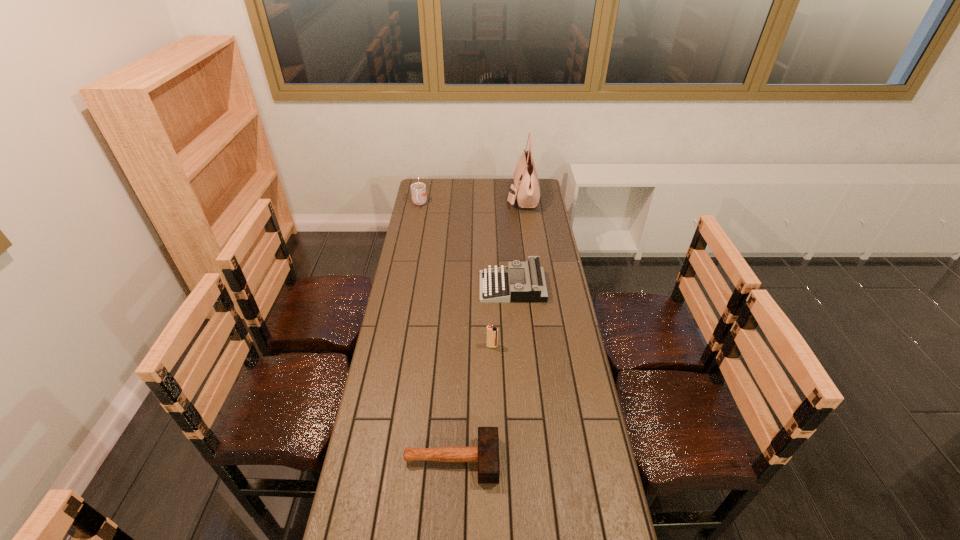
Identify the location of vacant space located on the side of the handbag with the attached pouch. The image size is (960, 540). (435, 197).

You are a GUI agent. You are given a task and a screenshot of the screen. Output one action in this format:
    pyautogui.click(x=<x>, y=<y>)
    Task: Click on the free region located on the side with the handle of the leftmost object
    The image size is (960, 540).
    Given the screenshot: What is the action you would take?
    pyautogui.click(x=412, y=244)

The height and width of the screenshot is (540, 960). Find the location of `vacant space located 0.060m on the right of the igniter`. vacant space located 0.060m on the right of the igniter is located at coordinates (514, 346).

Where is `vacant space located on the typing side of the third nearest object`? The image size is (960, 540). vacant space located on the typing side of the third nearest object is located at coordinates (398, 287).

Find the location of a particular element. Image resolution: width=960 pixels, height=540 pixels. vacant space located on the typing side of the third nearest object is located at coordinates 444,287.

This screenshot has height=540, width=960. What are the coordinates of `free space located 0.370m on the typing side of the third nearest object` in the screenshot? It's located at (394, 287).

Locate an element on the screen. Image resolution: width=960 pixels, height=540 pixels. vacant region located 0.230m on the hammer head face of the shortest object is located at coordinates (575, 460).

Find the location of `handbag located in the far edge section of the desktop`. handbag located in the far edge section of the desktop is located at coordinates (526, 189).

The image size is (960, 540). I want to click on cup that is positioned at the far edge, so pyautogui.click(x=418, y=190).

This screenshot has height=540, width=960. Identify the location of cup present at the left edge. (418, 190).